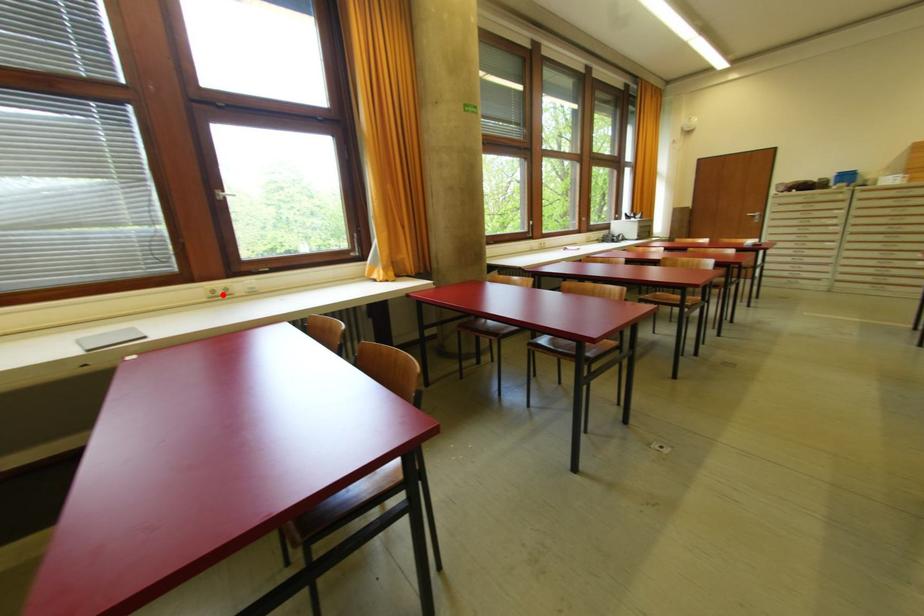
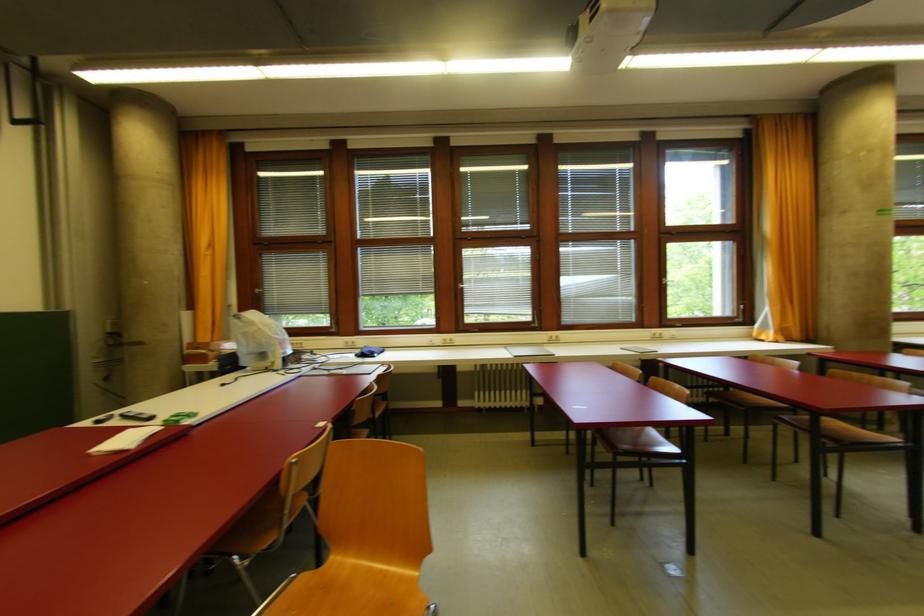
Question: A red point is marked in image1. In image2, is the corresponding 3D point closer to the camera or farther? Reply with the corresponding letter.

Choices:
 (A) The corresponding 3D point is closer.
 (B) The corresponding 3D point is farther.

Answer: (B)